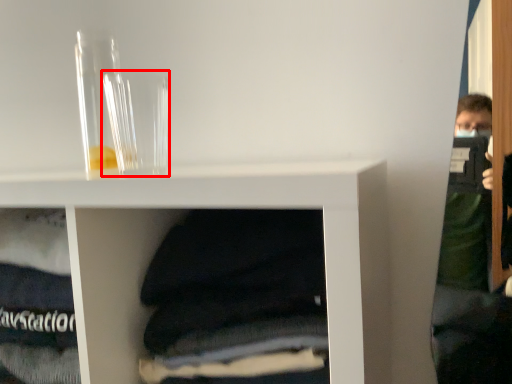
Question: From the image's perspective, what is the correct spatial positioning of glass vase (annotated by the red box) in reference to glass vase?

Choices:
 (A) above
 (B) below

Answer: (B)